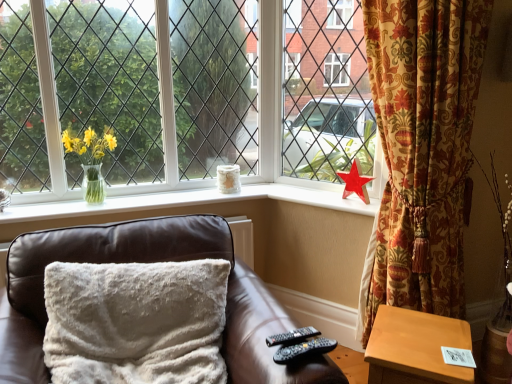
This screenshot has height=384, width=512. Describe the element at coordinates (190, 202) in the screenshot. I see `white glossy vase at upper center` at that location.

The height and width of the screenshot is (384, 512). What do you see at coordinates (304, 349) in the screenshot?
I see `black plastic remote at lower center, the first remote viewed from the front` at bounding box center [304, 349].

Image resolution: width=512 pixels, height=384 pixels. Identify the location of matte glass vase at upper center, acting as the 2th daffodil starting from the left. (355, 182).

Measure the distance between point (49,260) and camera.

They are 5.01 feet apart.

What do you see at coordinates (90, 159) in the screenshot?
I see `yellow glass vase at left, placed as the first daffodil when sorted from left to right` at bounding box center [90, 159].

What is the approximate height of yellow glass vase at left, placed as the first daffodil when sorted from left to right?

The height of yellow glass vase at left, placed as the first daffodil when sorted from left to right, is 14.75 inches.

You are a GUI agent. You are given a task and a screenshot of the screen. Output one action in this format:
    pyautogui.click(x=<x>, y=<y>)
    Task: Click on the white glossy vase at upper center
    This screenshot has width=512, height=384.
    Given the screenshot: What is the action you would take?
    pyautogui.click(x=190, y=202)

Measure the distance between yellow glass vase at left, placed as the first daffodil when sorted from left to right, and matte glass vase at upper center, acting as the 2th daffodil starting from the left.

The distance of yellow glass vase at left, placed as the first daffodil when sorted from left to right, from matte glass vase at upper center, acting as the 2th daffodil starting from the left, is 4.40 feet.

Considering the sizes of objects yellow glass vase at left, placed as the first daffodil when sorted from left to right, and matte glass vase at upper center, acting as the 2th daffodil starting from the left, in the image provided, who is bigger, yellow glass vase at left, placed as the first daffodil when sorted from left to right, or matte glass vase at upper center, acting as the 2th daffodil starting from the left,?

Bigger between the two is yellow glass vase at left, placed as the first daffodil when sorted from left to right.

Is yellow glass vase at left, positioned as the 2th daffodil in right-to-left order, oriented towards matte glass vase at upper center, which ranks as the first daffodil in right-to-left order?

No.

Which is more to the left, yellow glass vase at left, placed as the first daffodil when sorted from left to right, or matte glass vase at upper center, acting as the 2th daffodil starting from the left?

yellow glass vase at left, placed as the first daffodil when sorted from left to right, is more to the left.

From the picture: From the image's perspective, would you say brown leather couch at center is positioned over gold floral curtain at right?

Actually, brown leather couch at center appears below gold floral curtain at right in the image.

Where is `furniture in front of the gold floral curtain at right`? Image resolution: width=512 pixels, height=384 pixels. furniture in front of the gold floral curtain at right is located at coordinates (148, 262).

Who is smaller, brown leather couch at center or gold floral curtain at right?

Smaller between the two is gold floral curtain at right.

Consider the image. From a real-world perspective, is brown leather couch at center on gold floral curtain at right?

No.

Is black plastic remote at lower center, the first remote viewed from the front, oriented towards matte glass vase at upper center, which ranks as the first daffodil in right-to-left order?

No, black plastic remote at lower center, the first remote viewed from the front, is not oriented towards matte glass vase at upper center, which ranks as the first daffodil in right-to-left order.

Is black plastic remote at lower center, the first remote viewed from the front, to the right of matte glass vase at upper center, which ranks as the first daffodil in right-to-left order, from the viewer's perspective?

No, black plastic remote at lower center, the first remote viewed from the front, is not to the right of matte glass vase at upper center, which ranks as the first daffodil in right-to-left order.

Between point (302, 356) and point (358, 195), which one is positioned in front?

Point (302, 356)

Is there a large distance between black plastic remote at lower center, the 2th remote from the back, and matte glass vase at upper center, acting as the 2th daffodil starting from the left?

black plastic remote at lower center, the 2th remote from the back, is far away from matte glass vase at upper center, acting as the 2th daffodil starting from the left.

Which is further, [246,164] or [295,329]?

Point [246,164]

Are clear glass vase at left and black plastic remote at lower right, which appears as the 2th remote when viewed from the front, making contact?

No, clear glass vase at left is not touching black plastic remote at lower right, which appears as the 2th remote when viewed from the front.

Is clear glass vase at left spatially inside black plastic remote at lower right, the 1th remote in the back-to-front sequence, or outside of it?

clear glass vase at left lies outside black plastic remote at lower right, the 1th remote in the back-to-front sequence.

Consider the image. Who is more distant, black plastic remote at lower center, the 2th remote from the back, or white glossy vase at upper center?

white glossy vase at upper center is further away from the camera.

Is black plastic remote at lower center, the 2th remote from the back, turned away from white glossy vase at upper center?

Absolutely, black plastic remote at lower center, the 2th remote from the back, is directed away from white glossy vase at upper center.

From the image's perspective, which is below, black plastic remote at lower center, the 2th remote from the back, or white glossy vase at upper center?

black plastic remote at lower center, the 2th remote from the back.

Considering the relative sizes of black plastic remote at lower center, the first remote viewed from the front, and white glossy vase at upper center in the image provided, is black plastic remote at lower center, the first remote viewed from the front, thinner than white glossy vase at upper center?

Yes.

Is red plastic star at right facing away from brown leather couch at center?

No, brown leather couch at center is not at the back of red plastic star at right.

Is red plastic star at right wider or thinner than brown leather couch at center?

Considering their sizes, red plastic star at right looks slimmer than brown leather couch at center.

From a real-world perspective, which object stands above the other?

In real-world perspective, red plastic star at right is above.

At what (x,y) coordinates should I click in order to perform the action: click on furniture that appears below the red plastic star at right (from the image's perspective). Please return your answer as a coordinate pair (x, y). This screenshot has height=384, width=512. Looking at the image, I should click on (148, 262).

From a real-world perspective, does light brown wooden table at lower right sit lower than clear glass vase at left?

Yes.

Considering the positions of objects light brown wooden table at lower right and clear glass vase at left in the image provided, who is behind, light brown wooden table at lower right or clear glass vase at left?

clear glass vase at left.

Can you confirm if light brown wooden table at lower right is wider than clear glass vase at left?

Yes, light brown wooden table at lower right is wider than clear glass vase at left.

Visually, is light brown wooden table at lower right positioned to the left or to the right of clear glass vase at left?

light brown wooden table at lower right is positioned on clear glass vase at left's right side.

The image size is (512, 384). Find the location of `daffodil that appears above the matte glass vase at upper center, which ranks as the first daffodil in right-to-left order (from the image's perspective)`. daffodil that appears above the matte glass vase at upper center, which ranks as the first daffodil in right-to-left order (from the image's perspective) is located at coordinates (90, 159).

At what (x,y) coordinates should I click in order to perform the action: click on furniture located below the gold floral curtain at right (from the image's perspective). Please return your answer as a coordinate pair (x, y). The height and width of the screenshot is (384, 512). Looking at the image, I should click on (148, 262).

Looking at this image, when comparing their distances from yellow glass vase at left, positioned as the 2th daffodil in right-to-left order, does white glossy vase at upper center or black plastic remote at lower right, the 1th remote in the back-to-front sequence, seem closer?

white glossy vase at upper center lies closer to yellow glass vase at left, positioned as the 2th daffodil in right-to-left order, than the other object.

Estimate the real-world distances between objects in this image. Which object is closer to light brown wooden table at lower right, clear glass vase at left or matte glass vase at upper center, acting as the 2th daffodil starting from the left?

Among the two, matte glass vase at upper center, acting as the 2th daffodil starting from the left, is located nearer to light brown wooden table at lower right.

From the image, which object appears to be farther from red plastic star at right, black plastic remote at lower right, which appears as the 2th remote when viewed from the front, or white glossy vase at upper center?

Based on the image, black plastic remote at lower right, which appears as the 2th remote when viewed from the front, appears to be further to red plastic star at right.

Considering their positions, is black plastic remote at lower right, the 1th remote in the back-to-front sequence, positioned further to gold floral curtain at right than yellow glass vase at left, positioned as the 2th daffodil in right-to-left order?

yellow glass vase at left, positioned as the 2th daffodil in right-to-left order, lies further to gold floral curtain at right than the other object.

Based on the photo, from the image, which object appears to be farther from brown leather couch at center, white glossy vase at upper center or gold floral curtain at right?

Among the two, gold floral curtain at right is located further to brown leather couch at center.

Which object lies nearer to the anchor point light brown wooden table at lower right, black plastic remote at lower right, the 1th remote in the back-to-front sequence, or black plastic remote at lower center, the 2th remote from the back?

Based on the image, black plastic remote at lower center, the 2th remote from the back, appears to be nearer to light brown wooden table at lower right.

Based on their spatial positions, is black plastic remote at lower center, the 2th remote from the back, or clear glass vase at left further from red plastic star at right?

black plastic remote at lower center, the 2th remote from the back, is positioned further to the anchor red plastic star at right.

From the image, which object appears to be nearer to matte glass vase at upper center, which ranks as the first daffodil in right-to-left order, light brown wooden table at lower right or gold floral curtain at right?

The object closer to matte glass vase at upper center, which ranks as the first daffodil in right-to-left order, is gold floral curtain at right.

Where is `table between yellow glass vase at left, placed as the first daffodil when sorted from left to right, and gold floral curtain at right, in the horizontal direction`? The height and width of the screenshot is (384, 512). table between yellow glass vase at left, placed as the first daffodil when sorted from left to right, and gold floral curtain at right, in the horizontal direction is located at coordinates (415, 348).

Where is `table between brown leather couch at center and matte glass vase at upper center, acting as the 2th daffodil starting from the left, along the z-axis`? This screenshot has width=512, height=384. table between brown leather couch at center and matte glass vase at upper center, acting as the 2th daffodil starting from the left, along the z-axis is located at coordinates (415, 348).

You are a GUI agent. You are given a task and a screenshot of the screen. Output one action in this format:
    pyautogui.click(x=<x>, y=<y>)
    Task: Click on the window between brown leather couch at center and yellow glass vase at left, placed as the first daffodil when sorted from left to right, in the front-back direction
    This screenshot has height=384, width=512.
    Given the screenshot: What is the action you would take?
    pyautogui.click(x=183, y=92)

This screenshot has height=384, width=512. I want to click on window sill between yellow glass vase at left, placed as the first daffodil when sorted from left to right, and matte glass vase at upper center, which ranks as the first daffodil in right-to-left order, in the horizontal direction, so click(x=190, y=202).